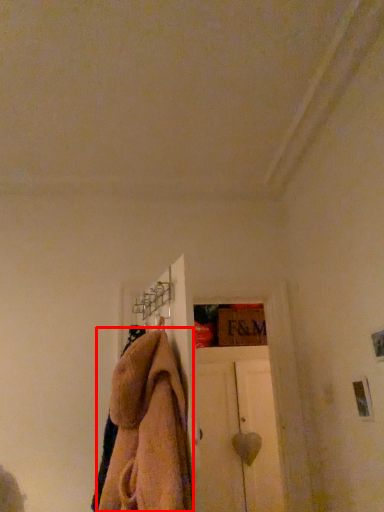
Question: From the image's perspective, considering the relative positions of towel (annotated by the red box) and door in the image provided, where is towel (annotated by the red box) located with respect to the staircase?

Choices:
 (A) above
 (B) below

Answer: (A)